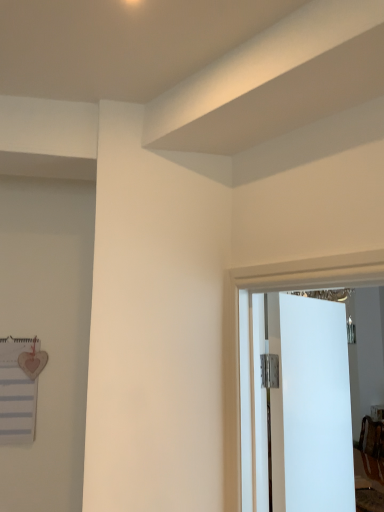
Question: Is white glossy door at center wider or thinner than white paperboard at left?

Choices:
 (A) thin
 (B) wide

Answer: (B)

Question: Which is correct: white glossy door at center is inside white paperboard at left, or outside of it?

Choices:
 (A) outside
 (B) inside

Answer: (A)

Question: From their relative heights in the image, would you say white glossy door at center is taller or shorter than white paperboard at left?

Choices:
 (A) short
 (B) tall

Answer: (B)

Question: In the image, is white paperboard at left positioned in front of or behind white glossy door at center?

Choices:
 (A) behind
 (B) front

Answer: (A)

Question: Is white paperboard at left wider or thinner than white glossy door at center?

Choices:
 (A) wide
 (B) thin

Answer: (B)

Question: Is white paperboard at left spatially inside white glossy door at center, or outside of it?

Choices:
 (A) inside
 (B) outside

Answer: (B)

Question: Considering the positions of white paperboard at left and white glossy door at center in the image, is white paperboard at left bigger or smaller than white glossy door at center?

Choices:
 (A) big
 (B) small

Answer: (B)